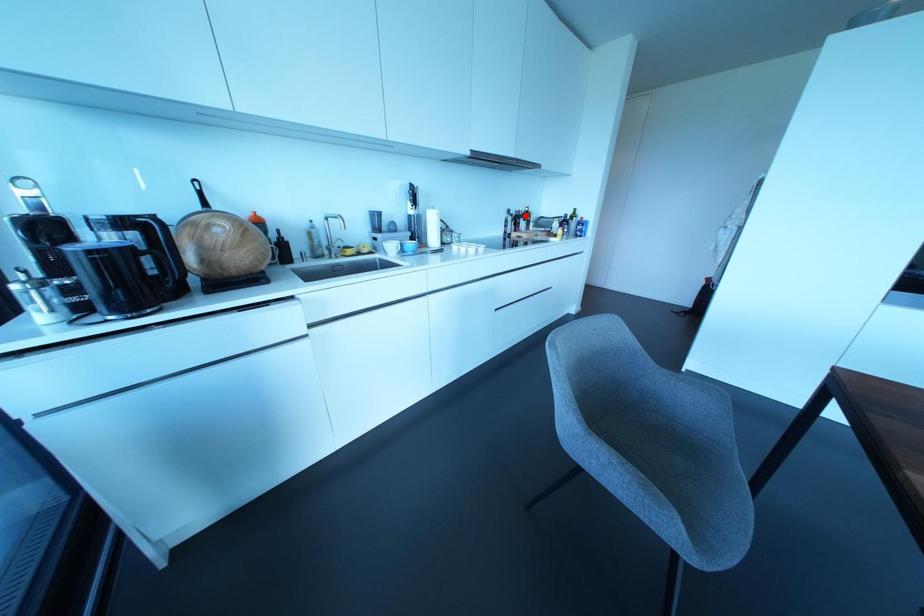
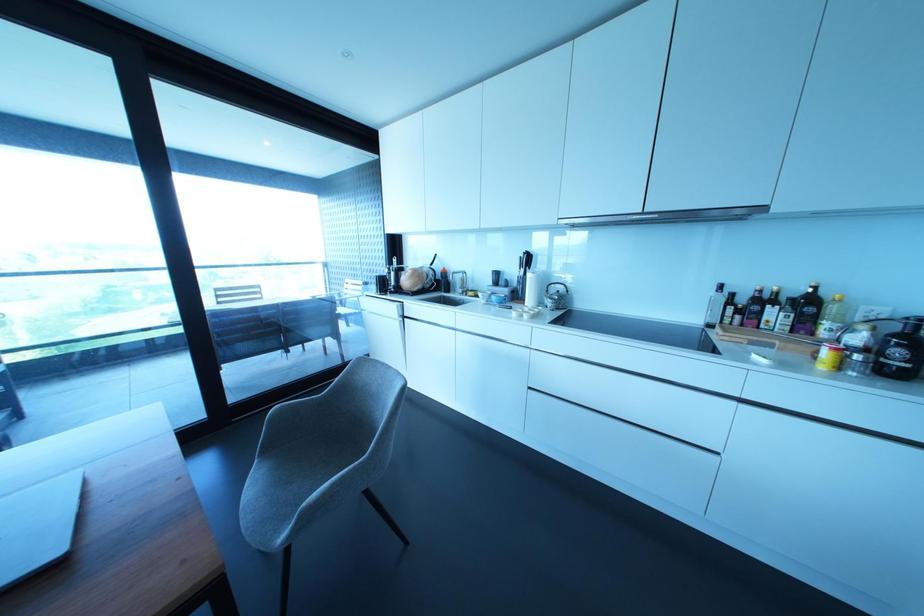
Question: I am providing you with two images of the same scene from different viewpoints. A red point is shown in image1. For the corresponding object point in image2, is it positioned nearer or farther from the camera?

Choices:
 (A) Nearer
 (B) Farther

Answer: (B)